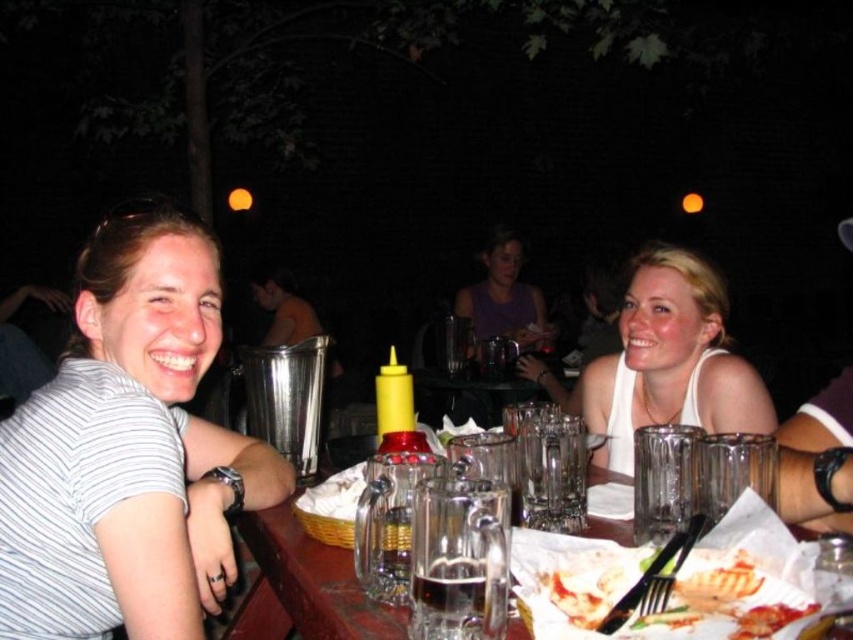
Who is shorter, grilled chicken at center or matte purple tank top at center?

grilled chicken at center is shorter.

Does grilled chicken at center appear on the left side of matte purple tank top at center?

Indeed, grilled chicken at center is positioned on the left side of matte purple tank top at center.

Which is in front, point (726, 577) or point (517, 244)?

Point (726, 577)

This screenshot has width=853, height=640. I want to click on grilled chicken at center, so click(x=722, y=602).

Looking at this image, can you confirm if white matte tank top at upper right is positioned to the right of matte purple tank top at center?

Correct, you'll find white matte tank top at upper right to the right of matte purple tank top at center.

Which is above, white matte tank top at upper right or matte purple tank top at center?

matte purple tank top at center is above.

Identify the location of white matte tank top at upper right. (670, 360).

The image size is (853, 640). What are the coordinates of `white matte tank top at upper right` in the screenshot? It's located at (670, 360).

Can you confirm if translucent glass beer at table center is thinner than matte purple tank top at center?

Yes, translucent glass beer at table center is thinner than matte purple tank top at center.

Is translucent glass beer at table center shorter than matte purple tank top at center?

Indeed, translucent glass beer at table center has a lesser height compared to matte purple tank top at center.

Which is behind, point (479, 570) or point (538, 324)?

The point (538, 324) is behind.

The height and width of the screenshot is (640, 853). Identify the location of translucent glass beer at table center. (460, 598).